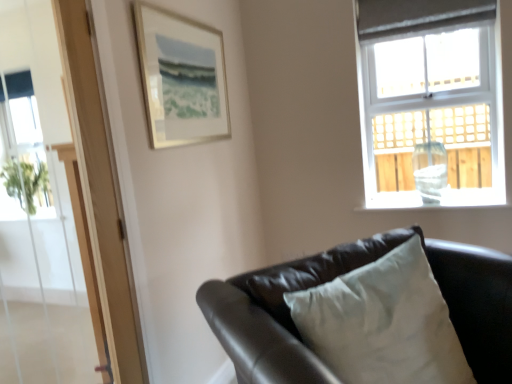
Question: From a real-world perspective, is matte glass vase at upper right physically located above or below silver metallic picture frame at upper left?

Choices:
 (A) above
 (B) below

Answer: (B)

Question: Considering the positions of matte glass vase at upper right and silver metallic picture frame at upper left in the image, is matte glass vase at upper right taller or shorter than silver metallic picture frame at upper left?

Choices:
 (A) tall
 (B) short

Answer: (A)

Question: Based on their relative distances, which object is farther from the white glass at upper right?

Choices:
 (A) silver metallic picture frame at upper left
 (B) clear glass door at left
 (C) transparent glass screen door at upper left
 (D) matte glass vase at upper right
 (E) matte black couch at lower right

Answer: (B)

Question: Which of these objects is positioned farthest from the matte glass vase at upper right?

Choices:
 (A) transparent glass screen door at upper left
 (B) silver metallic picture frame at upper left
 (C) clear glass door at left
 (D) matte black couch at lower right
 (E) transparent glass vase at window

Answer: (C)